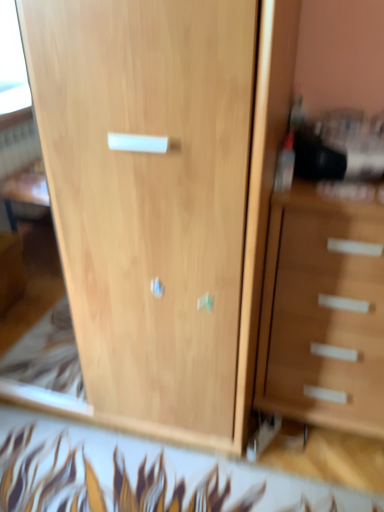
You are a GUI agent. You are given a task and a screenshot of the screen. Output one action in this format:
    pyautogui.click(x=<x>, y=<y>)
    Task: Click on the vacant space underneath light wood cupboard at center (from a real-world perspective)
    
    Given the screenshot: What is the action you would take?
    pyautogui.click(x=41, y=353)